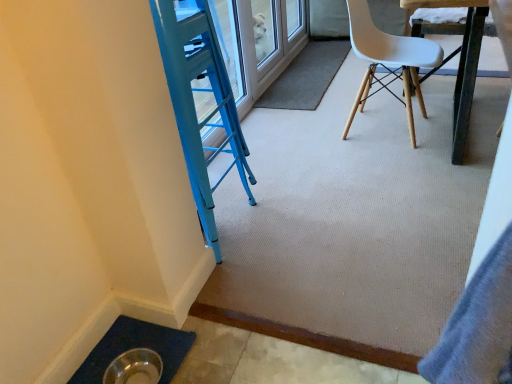
At what (x,y) coordinates should I click in order to perform the action: click on vacant region under white plastic chair at upper right (from a real-world perspective). Please return your answer as a coordinate pair (x, y). Looking at the image, I should click on (362, 122).